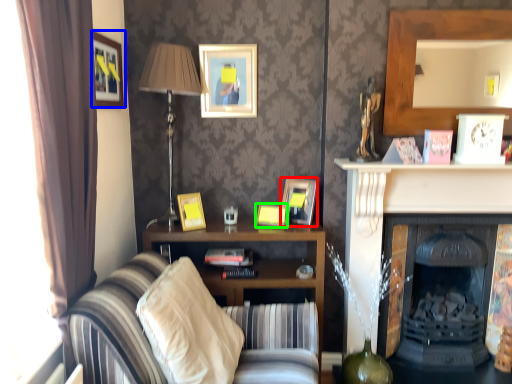
Question: Considering the real-world distances, which object is closest to picture frame (highlighted by a red box)? picture frame (highlighted by a blue box) or picture frame (highlighted by a green box).

Choices:
 (A) picture frame
 (B) picture frame

Answer: (B)